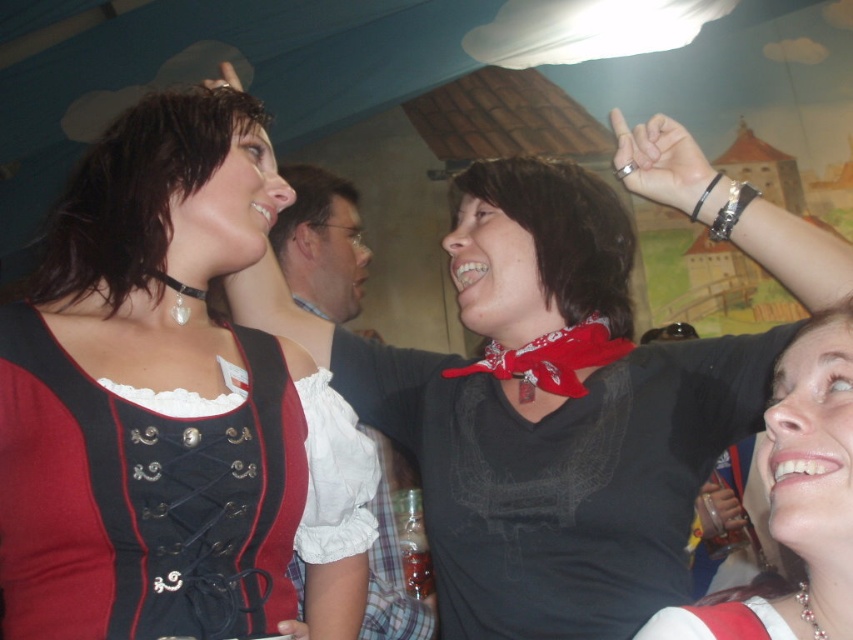
Can you confirm if matte black shirt at upper right is wider than matte black ring at upper center?

Yes, matte black shirt at upper right is wider than matte black ring at upper center.

Which is behind, point (796, 608) or point (231, 72)?

Positioned behind is point (231, 72).

What are the coordinates of `matte black shirt at upper right` in the screenshot? It's located at (796, 500).

Find the location of a particular element. The width and height of the screenshot is (853, 640). matte black shirt at upper right is located at coordinates (796, 500).

Does black matte shirt at center appear on the left side of matte black vest at center?

Incorrect, black matte shirt at center is not on the left side of matte black vest at center.

Does black matte shirt at center appear under matte black vest at center?

Correct, black matte shirt at center is located below matte black vest at center.

Where is `black matte shirt at center`? The width and height of the screenshot is (853, 640). black matte shirt at center is located at coordinates (544, 465).

Is black leather choker at upper left positioned behind matte black vest at center?

No.

This screenshot has height=640, width=853. What do you see at coordinates (137, 195) in the screenshot?
I see `black leather choker at upper left` at bounding box center [137, 195].

At what (x,y) coordinates should I click in order to perform the action: click on black leather choker at upper left. Please return your answer as a coordinate pair (x, y). Looking at the image, I should click on (137, 195).